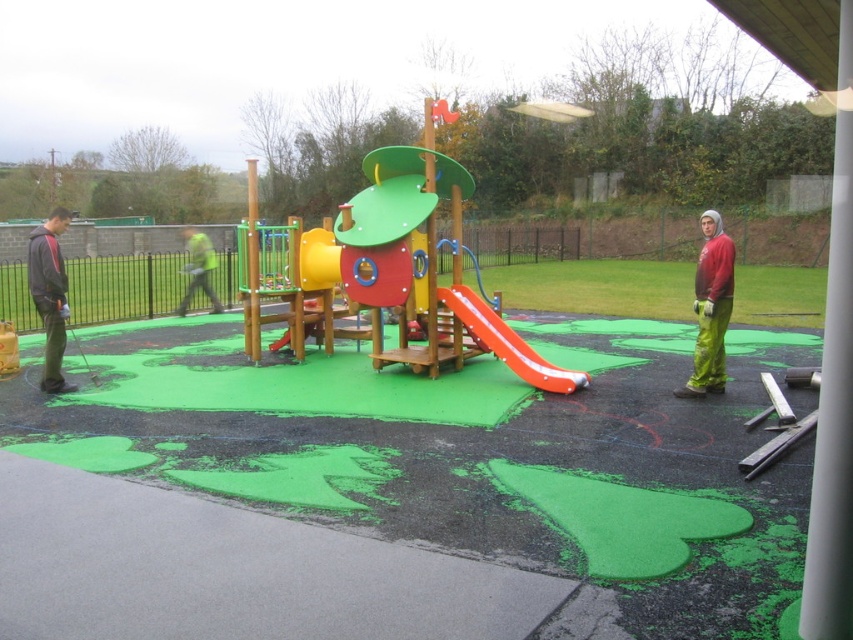
Describe the element at coordinates (508, 342) in the screenshot. Image resolution: width=853 pixels, height=640 pixels. I see `rubber smooth slide at center` at that location.

Is rubber smooth slide at center closer to camera compared to green fabric jacket at center?

Yes, rubber smooth slide at center is closer to the viewer.

Find the location of a particular element. rubber smooth slide at center is located at coordinates (508, 342).

Consider the image. Between red matte jacket at right and dark gray hoodie at left, which one has less height?

With less height is dark gray hoodie at left.

Can you confirm if red matte jacket at right is smaller than dark gray hoodie at left?

No, red matte jacket at right is not smaller than dark gray hoodie at left.

Which is behind, point (704, 225) or point (59, 369)?

Positioned behind is point (59, 369).

Find the location of a particular element. This screenshot has width=853, height=640. red matte jacket at right is located at coordinates (711, 308).

Between red matte jacket at right and green fabric jacket at center, which one has more height?

→ With more height is red matte jacket at right.

Does red matte jacket at right have a greater height compared to green fabric jacket at center?

Correct, red matte jacket at right is much taller as green fabric jacket at center.

Between point (705, 360) and point (187, 237), which one is positioned behind?

The point (187, 237) is behind.

You are a GUI agent. You are given a task and a screenshot of the screen. Output one action in this format:
    pyautogui.click(x=<x>, y=<y>)
    Task: Click on the red matte jacket at right
    This screenshot has height=640, width=853.
    Given the screenshot: What is the action you would take?
    pyautogui.click(x=711, y=308)